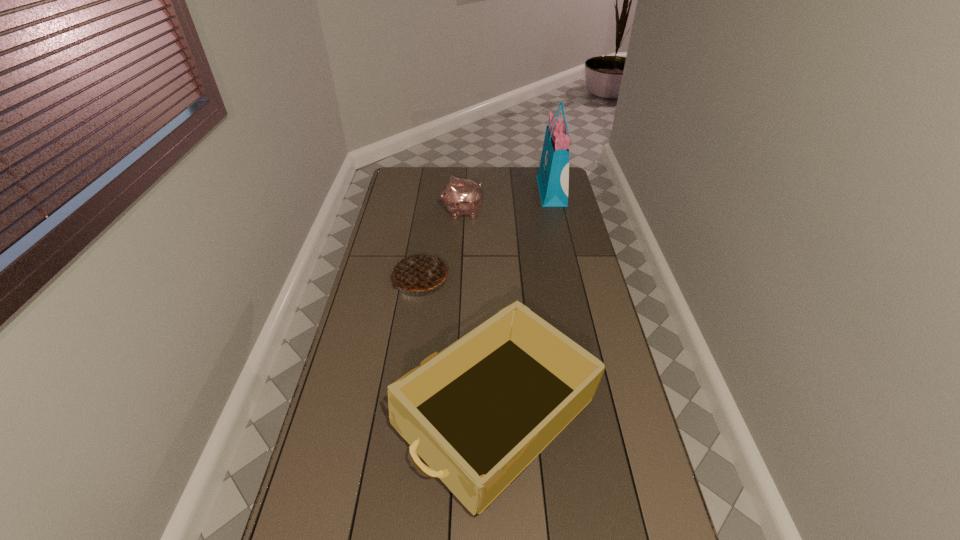
I want to click on free space located 0.250m on the back of the third farthest object, so click(428, 225).

In order to click on object present at the far edge in this screenshot , I will do `click(553, 175)`.

In order to click on object that is at the left edge in this screenshot , I will do `click(420, 271)`.

In order to click on shopping bag situated at the right edge in this screenshot , I will do `click(553, 175)`.

Find the location of a particular element. This screenshot has height=540, width=960. box situated at the right edge is located at coordinates (478, 413).

You are a GUI agent. You are given a task and a screenshot of the screen. Output one action in this format:
    pyautogui.click(x=<x>, y=<y>)
    Task: Click on the object that is at the far right corner
    
    Given the screenshot: What is the action you would take?
    click(x=553, y=175)

This screenshot has height=540, width=960. In order to click on vacant position at the far edge of the desktop in this screenshot , I will do `click(516, 186)`.

This screenshot has width=960, height=540. Identify the location of free space at the left edge. (383, 364).

The height and width of the screenshot is (540, 960). In order to click on free space at the right edge of the desktop in this screenshot , I will do `click(606, 330)`.

Find the location of a particular element. vacant area that lies between the nearest object and the piggy bank is located at coordinates (480, 314).